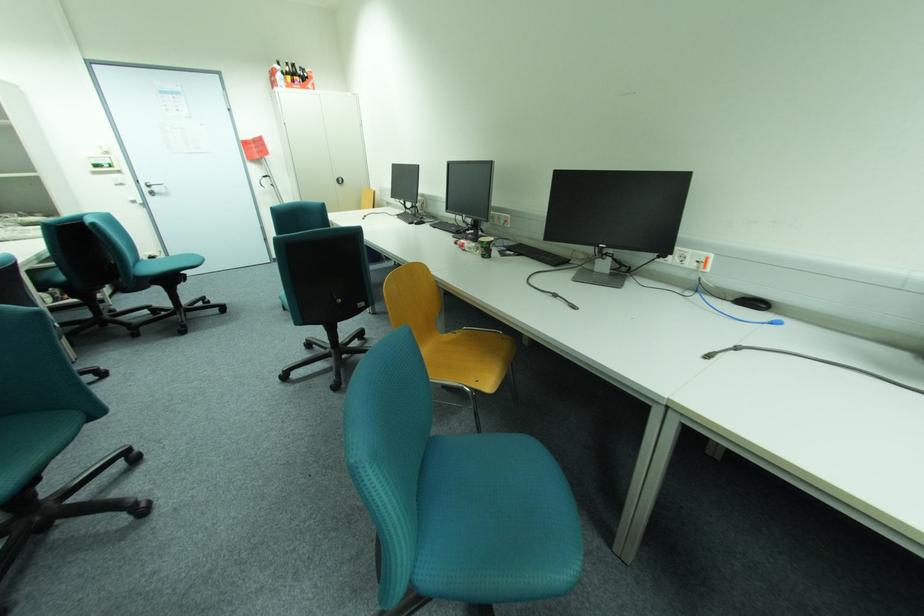
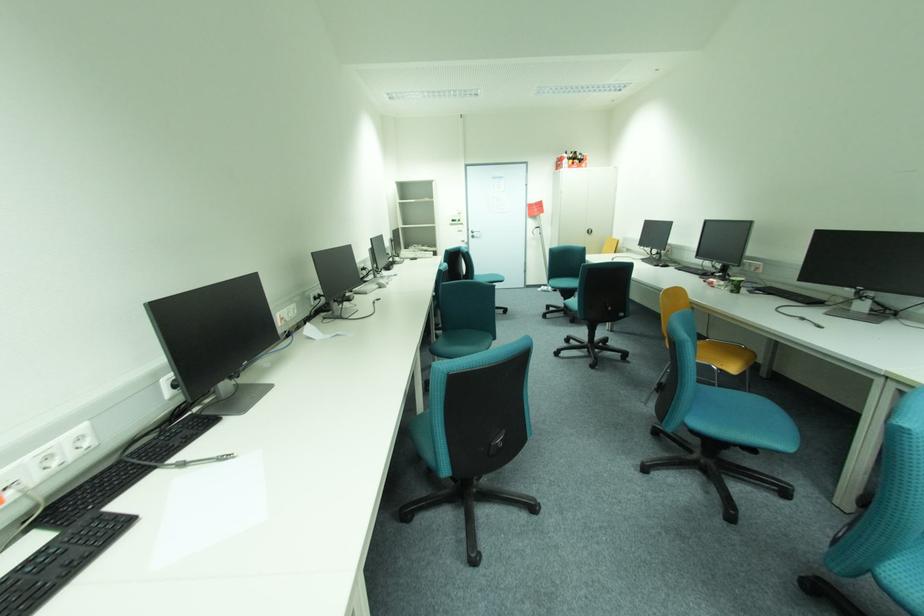
Where in the second image is the point corresponding to (x=475, y=390) from the first image?

(722, 369)